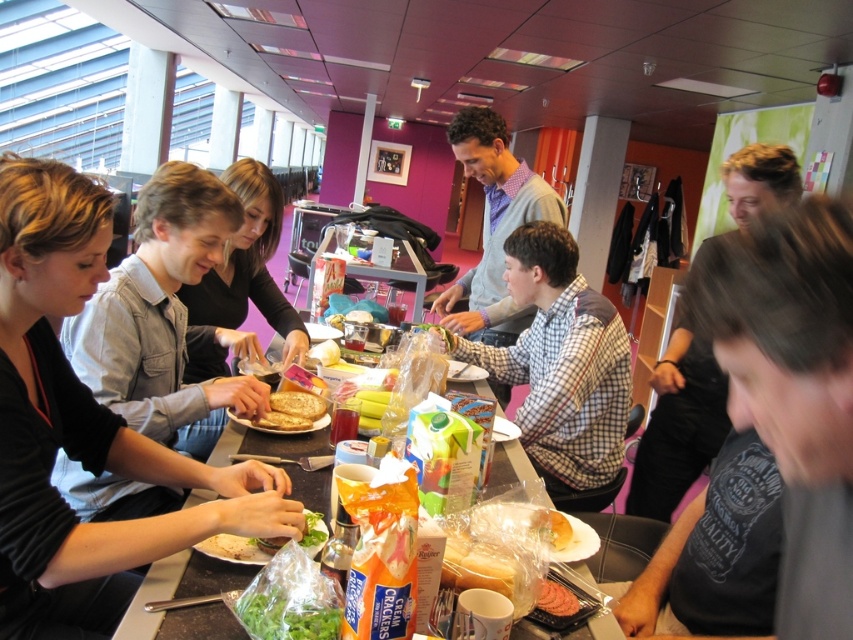
You are a photographer trying to capture a closeup of both the white checkered shirt at center and the sliced pink meat at center. Given their sizes, which object will require you to move closer to fill the frame?

The sliced pink meat at center is smaller than the white checkered shirt at center, so you will need to move closer to the sliced pink meat at center to fill the frame.

You are a food delivery person who needs to place a hot meal on the table without getting too close to the black cotton shirt at right. The minimum safe distance required is 20 inches to prevent spills. Can you safely place the meal near the sliced pink meat at center?

The distance between the black cotton shirt at right and the sliced pink meat at center is 21.76 inches, which exceeds the 20 inches minimum safe distance. Therefore, placing the meal near the sliced pink meat at center would be safe and keep it 21.76 inches away from the black cotton shirt at right.